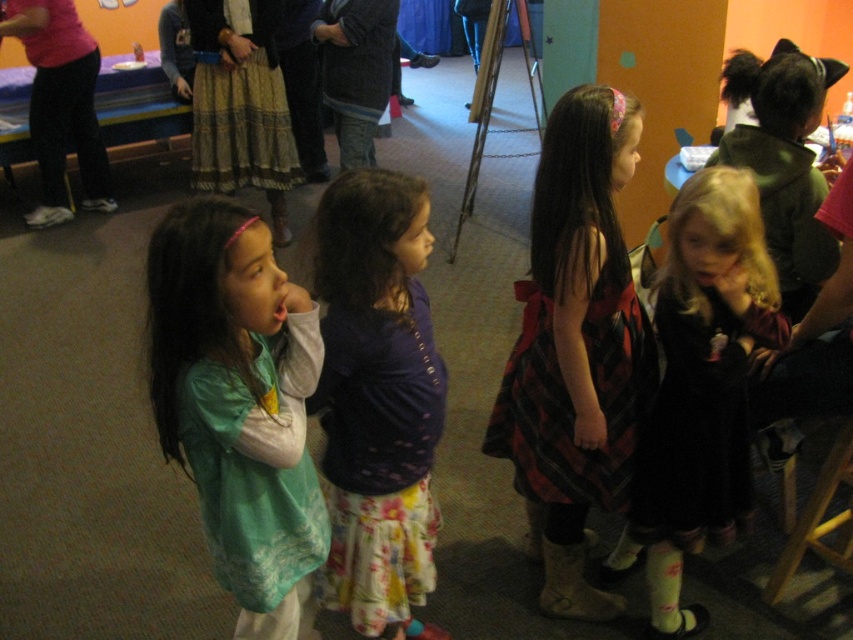
Is plaid fabric dress at center taller than black velvet dress at right?

Indeed, plaid fabric dress at center has a greater height compared to black velvet dress at right.

Which of these two, plaid fabric dress at center or black velvet dress at right, stands taller?

plaid fabric dress at center is taller.

Is point (610, 186) positioned in front of point (691, 404)?

Yes, it is.

Identify the location of plaid fabric dress at center. This screenshot has height=640, width=853. (576, 348).

Is point (410, 289) farther from camera compared to point (846, 456)?

No, (410, 289) is closer to viewer.

Does floral skirt at center have a greater width compared to wooden stool at lower right?

Incorrect, floral skirt at center's width does not surpass wooden stool at lower right's.

Describe the element at coordinates (376, 396) in the screenshot. I see `floral skirt at center` at that location.

Locate an element on the screen. floral skirt at center is located at coordinates point(376,396).

Is teal satin dress at left closer to camera compared to floral skirt at center?

Yes.

Between point (303, 477) and point (412, 300), which one is positioned behind?

Positioned behind is point (412, 300).

I want to click on teal satin dress at left, so click(x=239, y=404).